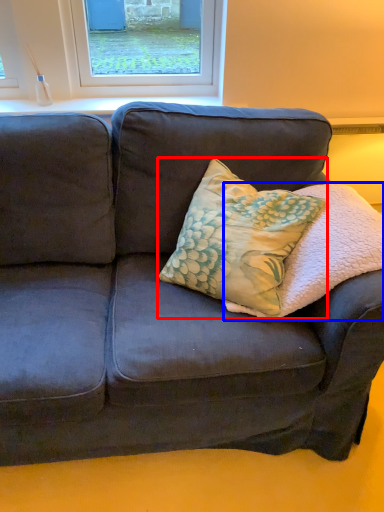
Question: Which object appears closest to the camera in this image, throw pillow (highlighted by a red box) or pillow (highlighted by a blue box)?

Choices:
 (A) throw pillow
 (B) pillow

Answer: (B)